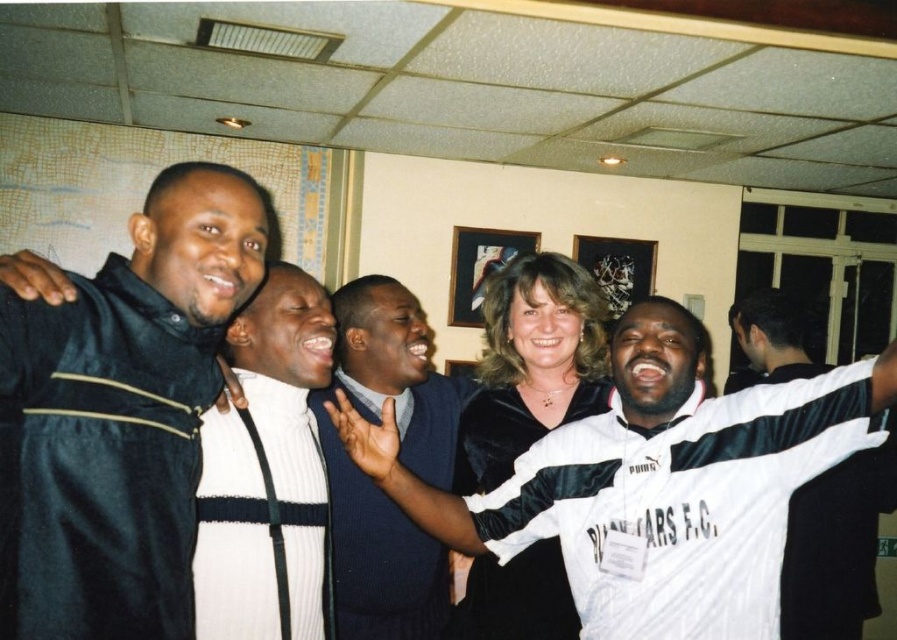
Question: Is white satin jacket at center to the right of velvet black dress at center from the viewer's perspective?

Choices:
 (A) yes
 (B) no

Answer: (B)

Question: Which object is closer to the camera taking this photo?

Choices:
 (A) white ribbed sweater at center
 (B) white satin jacket at center

Answer: (B)

Question: Which of the following is the closest to the observer?

Choices:
 (A) velvet black and white robe at center
 (B) velvet black dress at center
 (C) white ribbed sweater at center
 (D) velvet blue robe at center

Answer: (C)

Question: Is velvet black dress at center thinner than white satin shirt at right?

Choices:
 (A) yes
 (B) no

Answer: (B)

Question: Does velvet black dress at center come behind velvet blue robe at center?

Choices:
 (A) no
 (B) yes

Answer: (B)

Question: Which of the following is the farthest from the observer?

Choices:
 (A) velvet black and white robe at center
 (B) velvet black jacket at left
 (C) white ribbed sweater at center

Answer: (A)